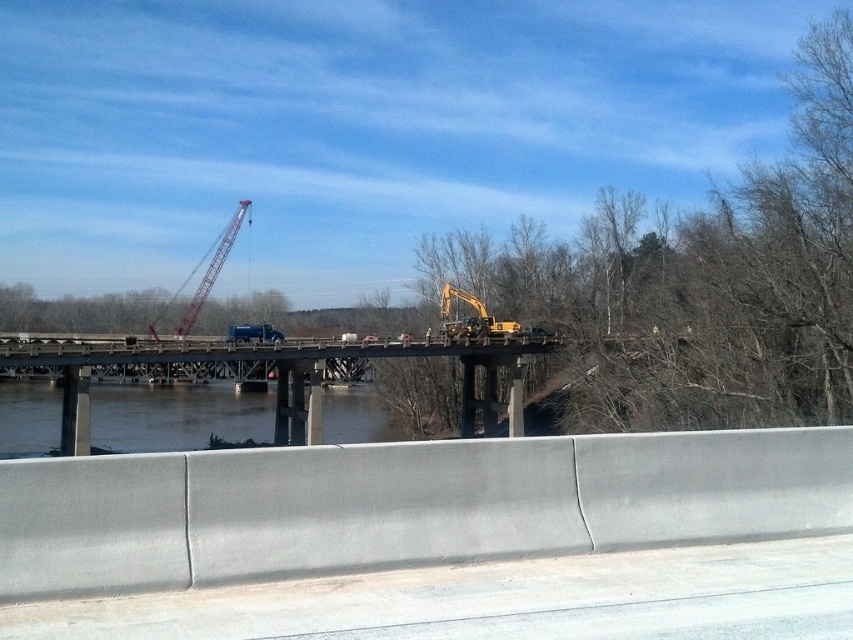
Question: Can you confirm if clear water at lower center is bigger than metallic red crane at center?

Choices:
 (A) yes
 (B) no

Answer: (B)

Question: Can you confirm if concrete bridge at center is smaller than clear water at lower center?

Choices:
 (A) yes
 (B) no

Answer: (B)

Question: Is concrete bridge at center further to camera compared to metallic red crane at center?

Choices:
 (A) no
 (B) yes

Answer: (A)

Question: Based on their relative distances, which object is nearer to the concrete bridge at center?

Choices:
 (A) metallic red crane at center
 (B) clear water at lower center

Answer: (B)

Question: Which of the following is the closest to the observer?

Choices:
 (A) metallic red crane at center
 (B) concrete bridge at center
 (C) clear water at lower center

Answer: (B)

Question: Which object is farther from the camera taking this photo?

Choices:
 (A) clear water at lower center
 (B) concrete bridge at center

Answer: (A)